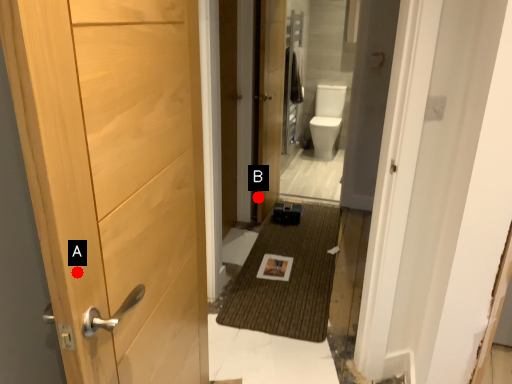
Question: Two points are circled on the image, labeled by A and B beside each circle. Which point appears farthest from the camera in this image?

Choices:
 (A) A is further
 (B) B is further

Answer: (B)